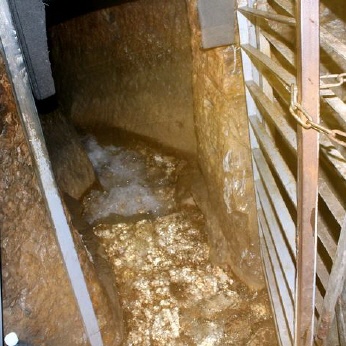
Where is `picture`? The height and width of the screenshot is (346, 346). picture is located at coordinates (131, 63).